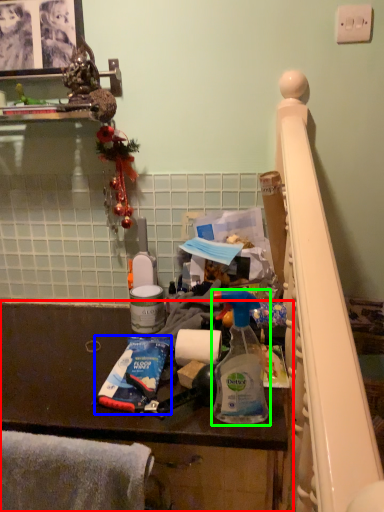
Question: Considering the real-world distances, which object is closest to furniture (highlighted by a red box)? toothpaste (highlighted by a blue box) or bottle (highlighted by a green box).

Choices:
 (A) toothpaste
 (B) bottle

Answer: (A)